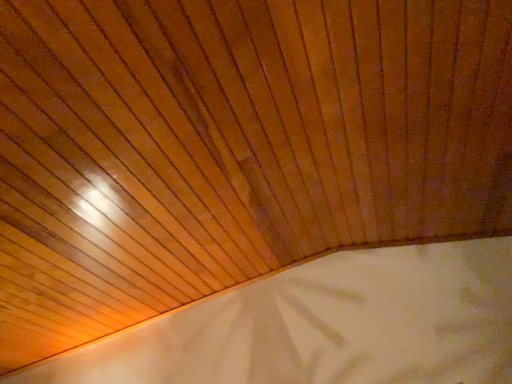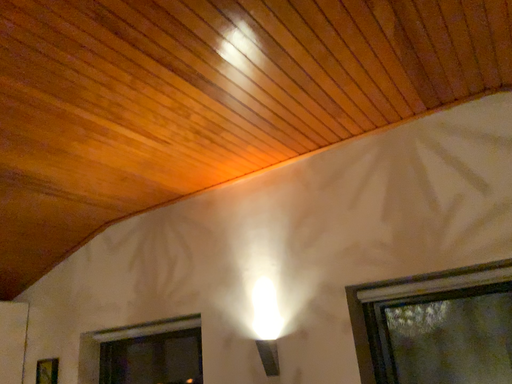
Question: How did the camera likely rotate when shooting the video?

Choices:
 (A) rotated upward
 (B) rotated downward

Answer: (B)